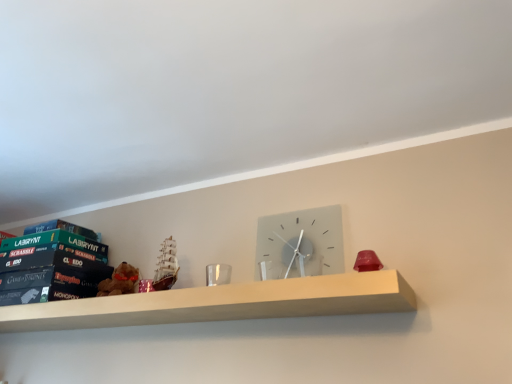
Question: Considering the relative sizes of wooden shelf at center and hardcover book at left, which appears as the 1th paperback book when ordered from the bottom, in the image provided, is wooden shelf at center thinner than hardcover book at left, which appears as the 1th paperback book when ordered from the bottom,?

Choices:
 (A) yes
 (B) no

Answer: (A)

Question: Considering the relative positions of wooden shelf at center and hardcover book at left, which appears as the 1th paperback book when ordered from the bottom, in the image provided, is wooden shelf at center to the left of hardcover book at left, which appears as the 1th paperback book when ordered from the bottom, from the viewer's perspective?

Choices:
 (A) no
 (B) yes

Answer: (A)

Question: Can hardcover book at left, which appears as the 1th paperback book when ordered from the bottom, be found inside wooden shelf at center?

Choices:
 (A) yes
 (B) no

Answer: (B)

Question: Considering the relative positions of wooden shelf at center and hardcover book at left, positioned as the third paperback book in top-to-bottom order, in the image provided, is wooden shelf at center behind hardcover book at left, positioned as the third paperback book in top-to-bottom order,?

Choices:
 (A) no
 (B) yes

Answer: (A)

Question: From a real-world perspective, is wooden shelf at center physically below hardcover book at left, positioned as the third paperback book in top-to-bottom order?

Choices:
 (A) yes
 (B) no

Answer: (A)

Question: In terms of height, does satin gray clock at center look taller or shorter compared to wooden shelf at center?

Choices:
 (A) short
 (B) tall

Answer: (B)

Question: Looking at the image, does satin gray clock at center seem bigger or smaller compared to wooden shelf at center?

Choices:
 (A) small
 (B) big

Answer: (A)

Question: In the image, is satin gray clock at center on the left side or the right side of wooden shelf at center?

Choices:
 (A) right
 (B) left

Answer: (A)

Question: Looking at their shapes, would you say satin gray clock at center is wider or thinner than wooden shelf at center?

Choices:
 (A) thin
 (B) wide

Answer: (A)

Question: Do you think wooden shelf at center is within green matte board game at left, which ranks as the 1th paperback book in top-to-bottom order, or outside of it?

Choices:
 (A) outside
 (B) inside

Answer: (A)

Question: Is wooden shelf at center taller or shorter than green matte board game at left, positioned as the third paperback book in bottom-to-top order?

Choices:
 (A) short
 (B) tall

Answer: (A)

Question: Based on their sizes in the image, would you say wooden shelf at center is bigger or smaller than green matte board game at left, which ranks as the 1th paperback book in top-to-bottom order?

Choices:
 (A) small
 (B) big

Answer: (B)

Question: In the image, is wooden shelf at center positioned in front of or behind green matte board game at left, positioned as the third paperback book in bottom-to-top order?

Choices:
 (A) behind
 (B) front

Answer: (B)

Question: Considering their positions, is satin gray clock at center located in front of or behind hardcover book at left, positioned as the third paperback book in top-to-bottom order?

Choices:
 (A) behind
 (B) front

Answer: (B)

Question: In terms of width, does satin gray clock at center look wider or thinner when compared to hardcover book at left, which appears as the 1th paperback book when ordered from the bottom?

Choices:
 (A) wide
 (B) thin

Answer: (B)